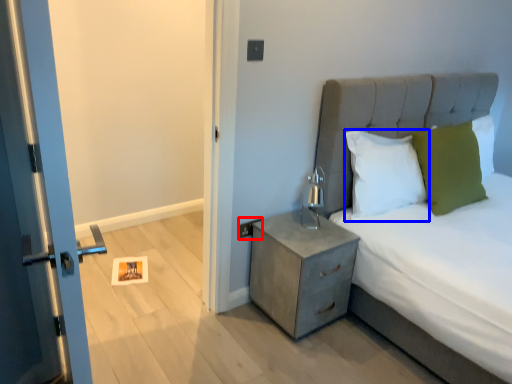
Question: Which point is closer to the camera, electric outlet (highlighted by a red box) or pillow (highlighted by a blue box)?

Choices:
 (A) electric outlet
 (B) pillow

Answer: (B)